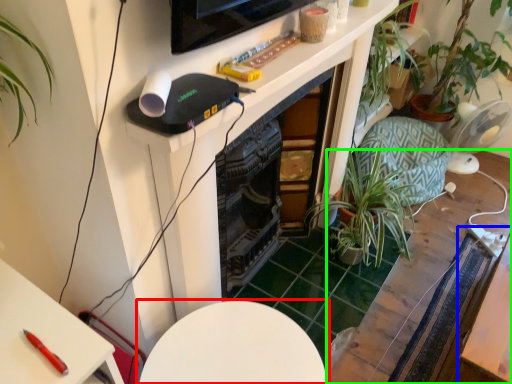
Question: Estimate the real-world distances between objects in this image. Which object is farther from table (highlighted by a red box), table (highlighted by a blue box) or table (highlighted by a green box)?

Choices:
 (A) table
 (B) table

Answer: (B)